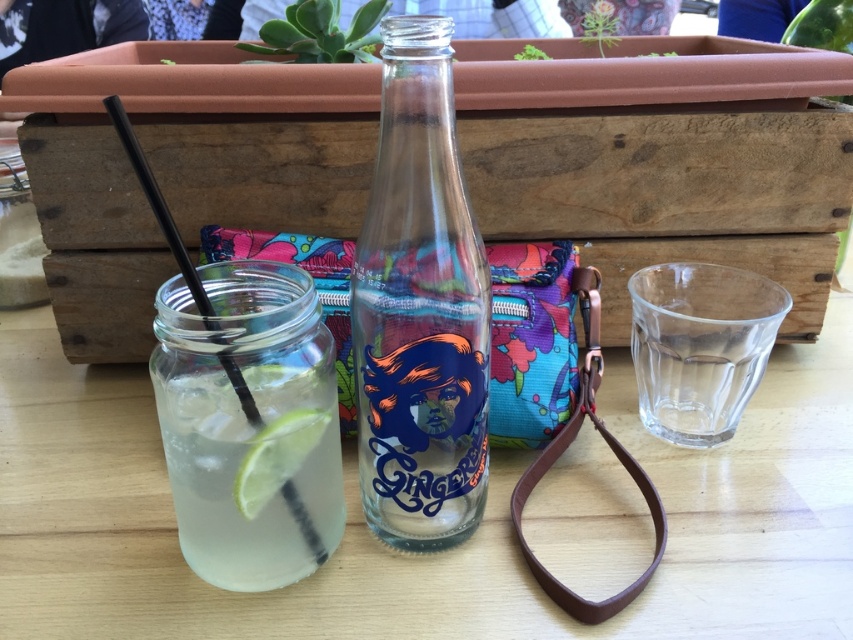
Question: Which object is the farthest from the black plastic straw at left?

Choices:
 (A) wooden crate at center
 (B) green matte lime at center

Answer: (A)

Question: Does brown leather strap at center have a lesser width compared to green matte lime at center?

Choices:
 (A) yes
 (B) no

Answer: (B)

Question: Which object is farther from the camera taking this photo?

Choices:
 (A) black plastic straw at left
 (B) green matte lime at center
 (C) transparent glass at right
 (D) clear wood table at center

Answer: (C)

Question: Which point appears closest to the camera in this image?

Choices:
 (A) (578, 477)
 (B) (579, 396)
 (C) (163, 228)
 (D) (724, 195)

Answer: (C)

Question: Is wooden crate at center below brown leather strap at center?

Choices:
 (A) yes
 (B) no

Answer: (B)

Question: Where is wooden crate at center located in relation to transparent glass bottle at center in the image?

Choices:
 (A) above
 (B) below

Answer: (A)